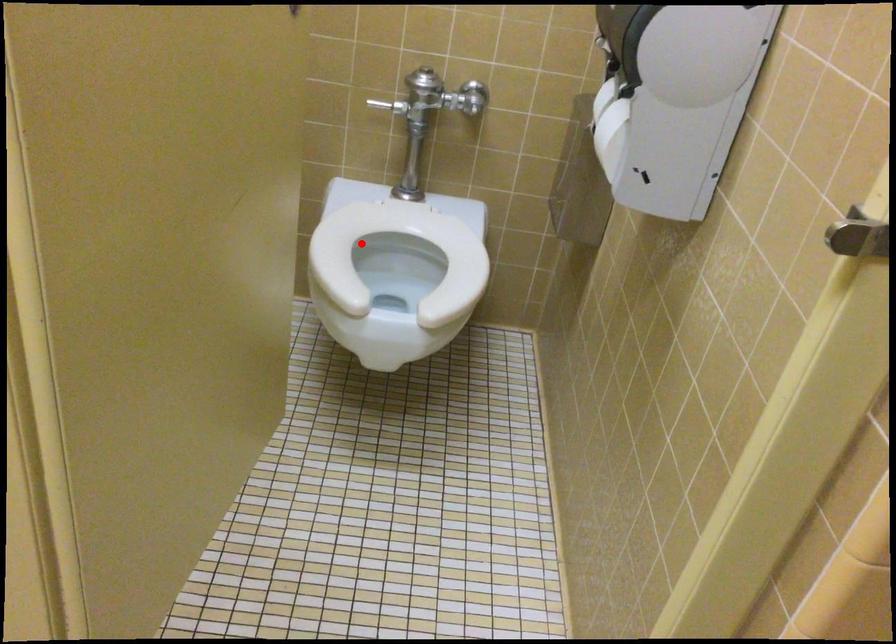
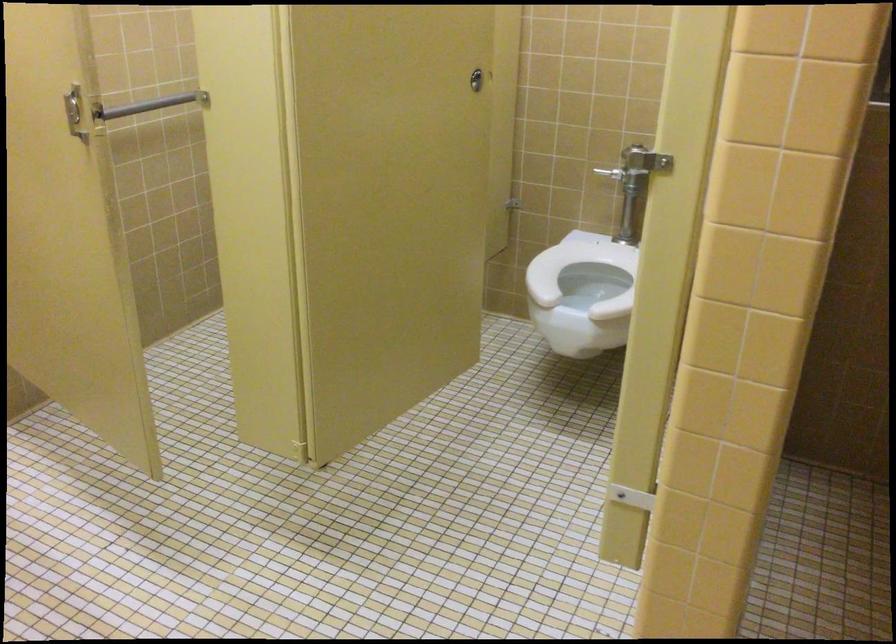
Question: I am providing you with two images of the same scene from different viewpoints. Given a red point in image1, look at the same physical point in image2. Is it:

Choices:
 (A) Closer to the viewpoint
 (B) Farther from the viewpoint

Answer: (B)